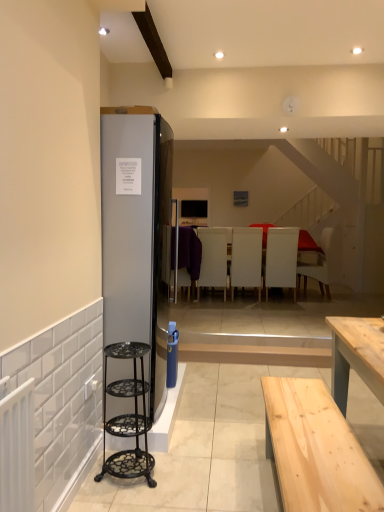
Find the location of `free space underneath black wrought iron step stool at left (from a real-world perspective)`. free space underneath black wrought iron step stool at left (from a real-world perspective) is located at coordinates (135, 473).